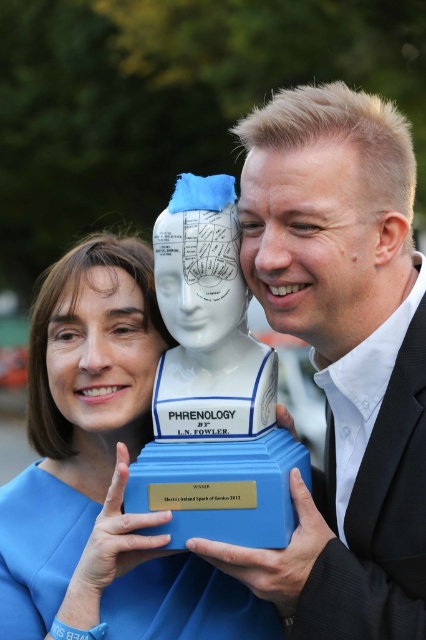
Does blue fabric dress at center have a greater width compared to blue plastic bust at center?

Indeed, blue fabric dress at center has a greater width compared to blue plastic bust at center.

Is point (147, 568) positioned before point (178, 436)?

No, (147, 568) is further to viewer.

Identify the location of blue fabric dress at center. (101, 474).

Can you confirm if white glossy bust at center is positioned above blue plastic bust at center?

Indeed, white glossy bust at center is positioned over blue plastic bust at center.

Does white glossy bust at center have a greater height compared to blue plastic bust at center?

Correct, white glossy bust at center is much taller as blue plastic bust at center.

Locate an element on the screen. white glossy bust at center is located at coordinates (342, 356).

Which is above, white glossy bust at center or blue fabric dress at center?

white glossy bust at center

Who is taller, white glossy bust at center or blue fabric dress at center?

white glossy bust at center

Describe the element at coordinates (342, 356) in the screenshot. I see `white glossy bust at center` at that location.

The image size is (426, 640). I want to click on white glossy bust at center, so pyautogui.click(x=342, y=356).